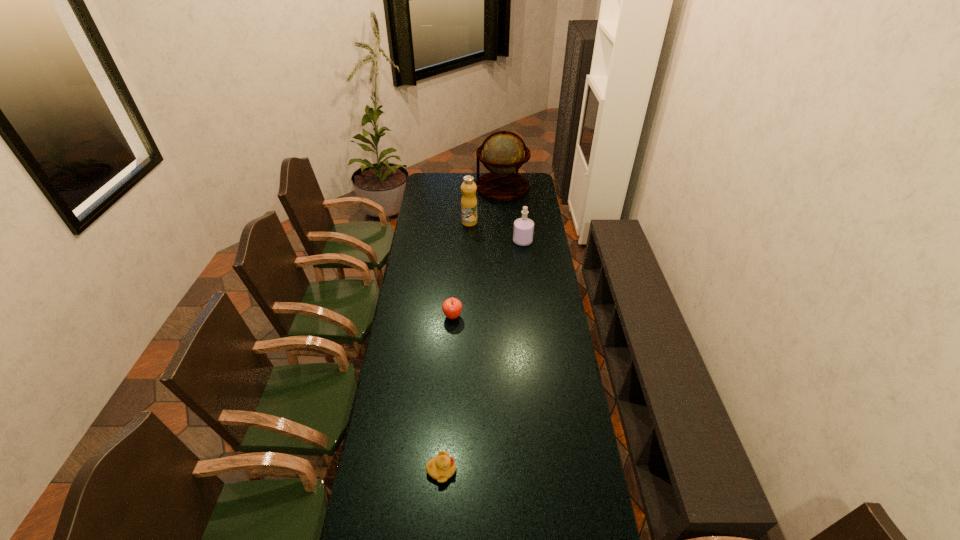
Image resolution: width=960 pixels, height=540 pixels. What are the coordinates of `the farthest object` in the screenshot? It's located at (503, 153).

The image size is (960, 540). Identify the location of globe. (503, 153).

Where is `the fourth nearest object`? Image resolution: width=960 pixels, height=540 pixels. the fourth nearest object is located at coordinates (468, 188).

Find the location of a particular element. fruit juice is located at coordinates (468, 188).

Locate an element on the screen. This screenshot has height=540, width=960. the third tallest object is located at coordinates (523, 227).

Identify the location of perfume. (523, 227).

You are a GUI agent. You are given a task and a screenshot of the screen. Output one action in this format:
    pyautogui.click(x=<x>, y=<y>)
    Task: Click on the second nearest object
    The width and height of the screenshot is (960, 540).
    Given the screenshot: What is the action you would take?
    pyautogui.click(x=452, y=307)

Locate an element on the screen. the fourth tallest object is located at coordinates (452, 307).

Locate an element on the screen. duckling is located at coordinates (442, 467).

This screenshot has height=540, width=960. Find the location of `the shortest object`. the shortest object is located at coordinates (442, 467).